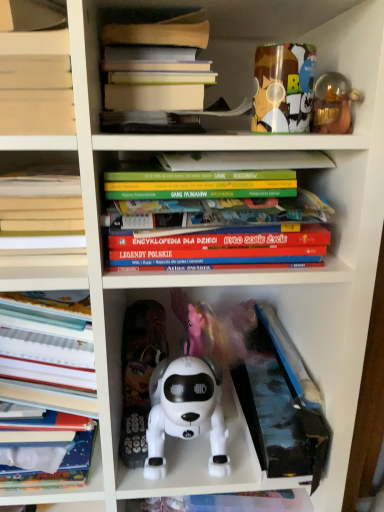
Question: Which is correct: hardcover book at left, acting as the third book starting from the top, is inside white plastic toy dog at center, acting as the second toy starting from the bottom, or outside of it?

Choices:
 (A) inside
 (B) outside

Answer: (B)

Question: Looking at the image, does hardcover book at left, which is the second book in bottom-to-top order, seem bigger or smaller compared to white plastic toy dog at center, acting as the second toy starting from the bottom?

Choices:
 (A) small
 (B) big

Answer: (B)

Question: Which object is the farthest from the hardcover book at left, which is the second book in bottom-to-top order?

Choices:
 (A) blue matte book at lower right
 (B) white plastic toy dog at center, placed as the 4th toy when sorted from right to left
 (C) white paper book at left, acting as the 1th book starting from the bottom
 (D) hardcover books at upper center, the 4th book when ordered from bottom to top
 (E) matte plastic cup at upper right, placed as the first toy when sorted from top to bottom

Answer: (A)

Question: Estimate the real-world distances between objects in this image. Which object is closer to the translucent glass figurine at upper right, which is the second toy from top to bottom?

Choices:
 (A) hardcover books at upper center, the 4th book when ordered from bottom to top
 (B) hardcover book at left, acting as the third book starting from the top
 (C) white paper book at left, positioned as the fourth book in top-to-bottom order
 (D) matte plastic cup at upper right, which appears as the 3th toy when viewed from the left
 (E) white plastic robot dog at center, which ranks as the second toy in left-to-right order

Answer: (D)